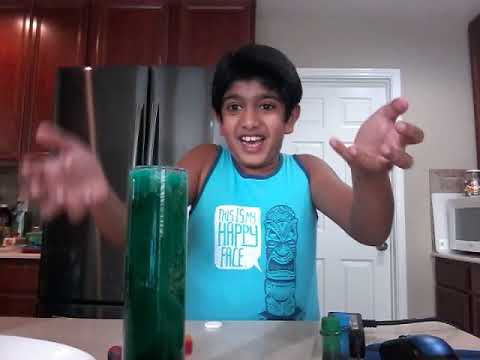
Locate an element on the screen. fridge is located at coordinates (122, 113), (177, 110).